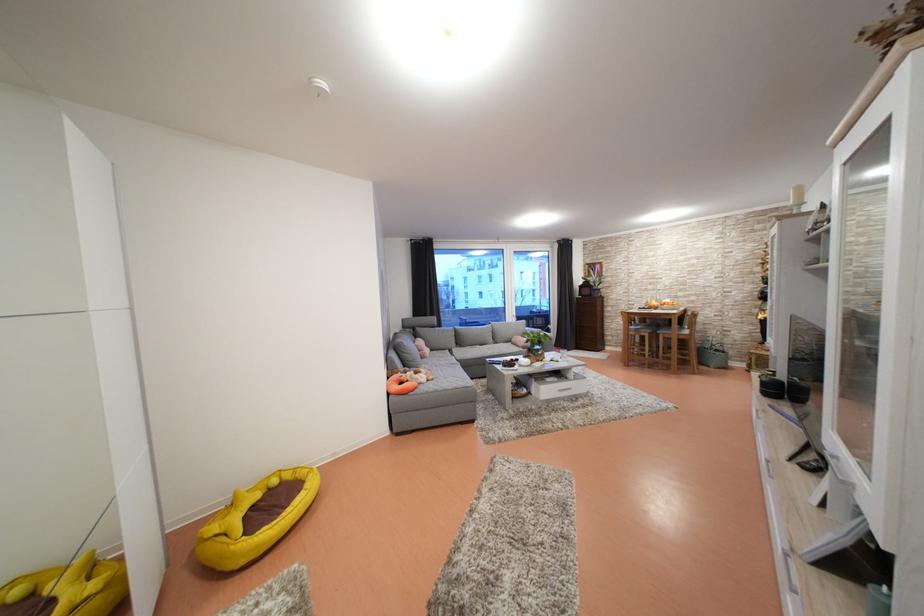
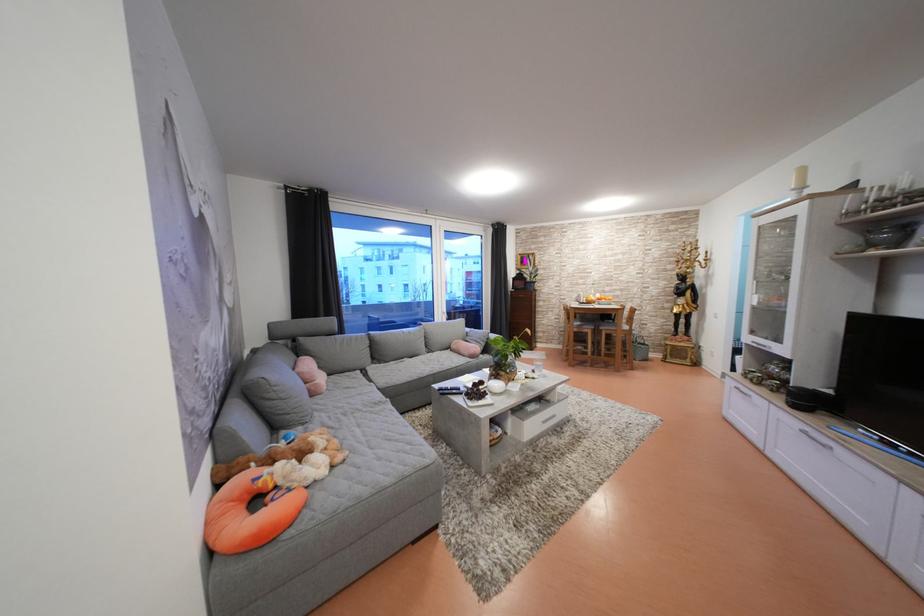
Question: Which direction would the cameraman need to move to produce the second image? Reply with the corresponding letter.

Choices:
 (A) Left
 (B) Right
 (C) Forward
 (D) Backward

Answer: (C)